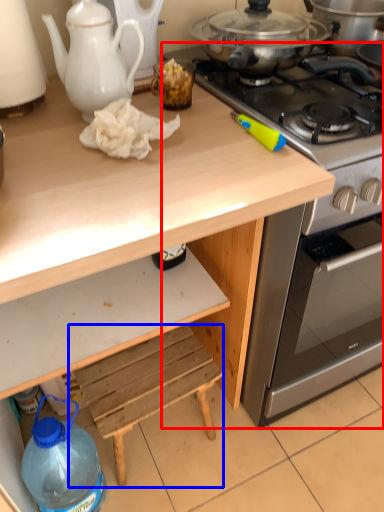
Question: Among these objects, which one is nearest to the camera, oven (highlighted by a red box) or step stool (highlighted by a blue box)?

Choices:
 (A) oven
 (B) step stool

Answer: (A)